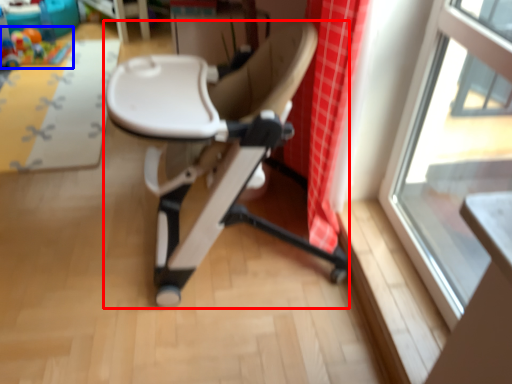
Question: Which point is closer to the camera, chair (highlighted by a red box) or toy (highlighted by a blue box)?

Choices:
 (A) chair
 (B) toy

Answer: (A)